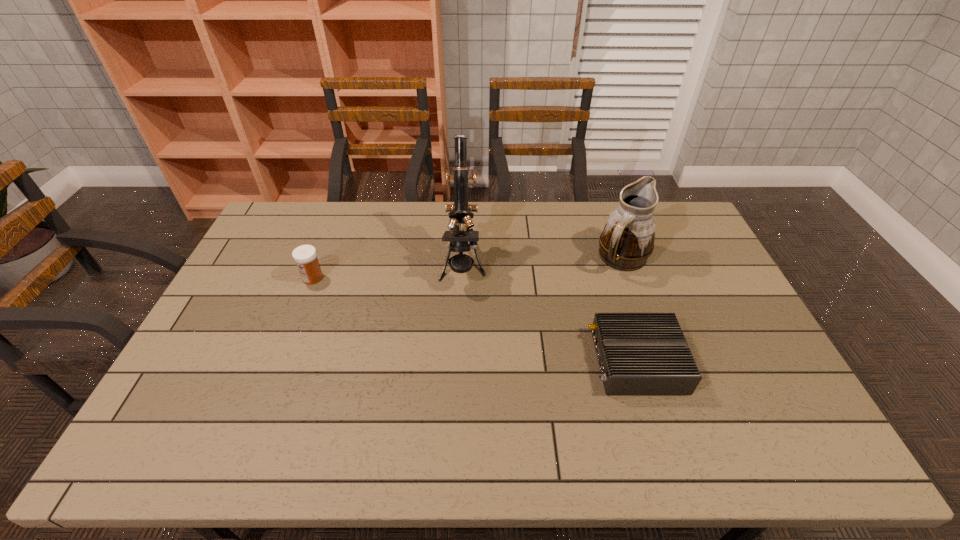
Find the location of a particular element. microscope is located at coordinates (460, 213).

Where is `the third object from right to left`? This screenshot has height=540, width=960. the third object from right to left is located at coordinates (460, 213).

The height and width of the screenshot is (540, 960). What are the coordinates of `pitcher` in the screenshot? It's located at (627, 240).

Where is `the leftmost object`? the leftmost object is located at coordinates (305, 256).

Image resolution: width=960 pixels, height=540 pixels. I want to click on medicine, so click(305, 256).

The image size is (960, 540). In order to click on router in this screenshot , I will do `click(638, 353)`.

The height and width of the screenshot is (540, 960). Identify the location of the nearest object. (638, 353).

At what (x,y) coordinates should I click in order to perform the action: click on vacant area situated through the eyepiece of the third object from right to left. Please return your answer as a coordinate pair (x, y). Looking at the image, I should click on (458, 384).

Locate an element on the screen. Image resolution: width=960 pixels, height=540 pixels. vacant space situated 0.210m from the spout of the pitcher is located at coordinates click(648, 330).

The width and height of the screenshot is (960, 540). I want to click on vacant position located 0.060m on the front of the leftmost object, so click(x=304, y=299).